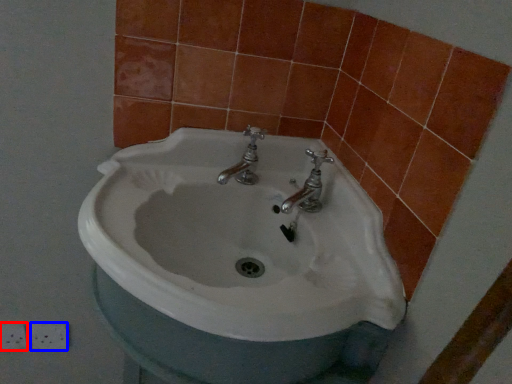
Question: Among these objects, which one is nearest to the camera, ceramic tile (highlighted by a red box) or ceramic tile (highlighted by a blue box)?

Choices:
 (A) ceramic tile
 (B) ceramic tile

Answer: (A)